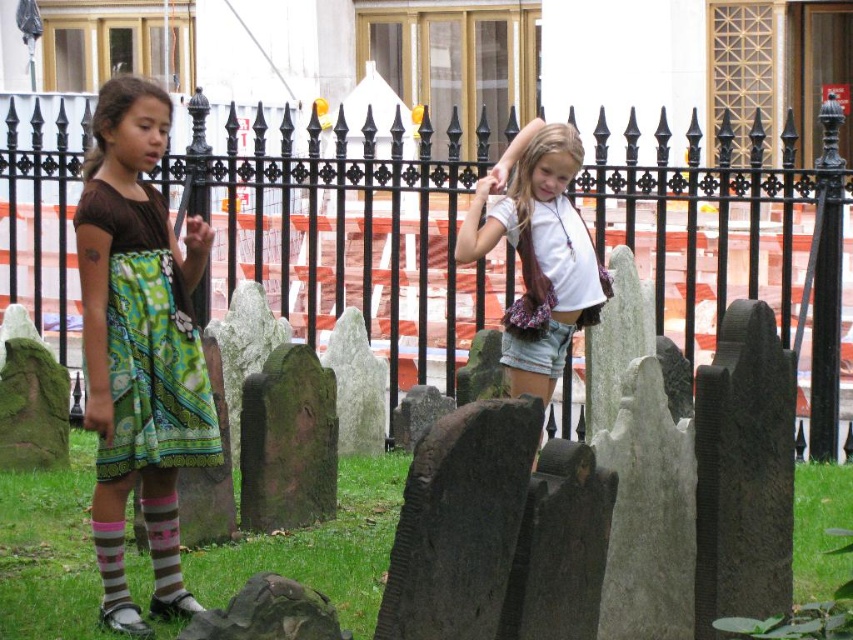
You are trying to determine the clothing items based on their thickness. Which item is thinner between the green printed fabric dress at left and the striped cotton socks at lower left?

The green printed fabric dress at left is thinner than the striped cotton socks at lower left according to the description.

You are a visitor at the cemetery and want to approach the green printed fabric dress at left. However, there is a black wrought iron fence at upper center in your way. Can you walk directly to the dress without going around the fence?

The green printed fabric dress at left is behind the black wrought iron fence at upper center, so you cannot walk directly to the dress without going around the fence.

You are taking a photo of the two girls standing near the gravestones. Which point, point (120,348) or point (152,508), will appear larger in your photo?

Point (120,348) will appear larger in the photo because it is closer to the camera than point (152,508).